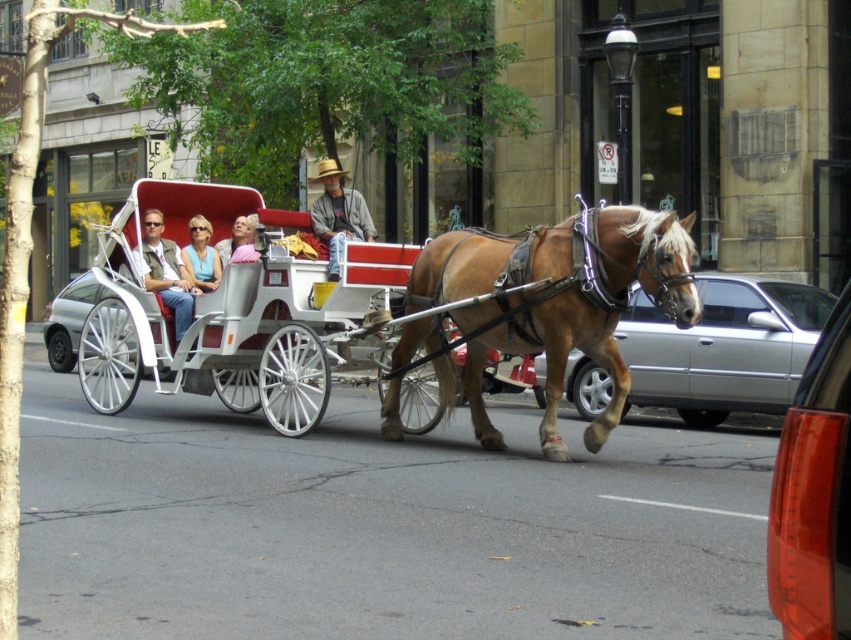
You are a photographer standing on the sidewalk. You want to take a photo of the denim jacket at center and the matte blue shirt at center so that both are in the frame. Considering your camera has a minimum focus distance of 5 feet, will both subjects be in focus?

The denim jacket at center and the matte blue shirt at center are 6.20 feet apart. Since the minimum focus distance is 5 feet, the 6.20 feet distance between them is greater than the minimum requirement, so both subjects will be in focus.

You are a photographer taking a picture of the passengers in the horse carriage. You notice two people wearing a denim jacket at center and a matte blue shirt at center. Which clothing item is smaller in size?

The denim jacket at center has a smaller size compared to the matte blue shirt at center.